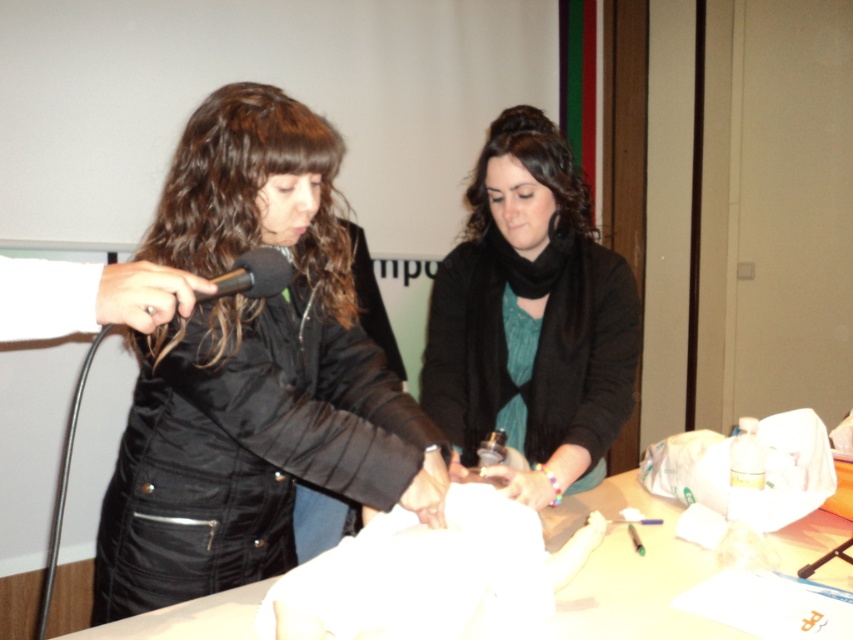
Question: Considering the real-world distances, which object is farthest from the white fabric at center?

Choices:
 (A) black matte jacket at center
 (B) black matte microphone at upper left

Answer: (B)

Question: Which point is farther to the camera?

Choices:
 (A) (451, 368)
 (B) (602, 556)
 (C) (461, 595)
 (D) (228, 275)

Answer: (A)

Question: Among these points, which one is nearest to the camera?

Choices:
 (A) (267, 156)
 (B) (200, 300)
 (C) (532, 148)
 (D) (374, 545)

Answer: (B)

Question: Is white fabric at center closer to camera compared to white paper at center?

Choices:
 (A) yes
 (B) no

Answer: (A)

Question: Does matte black scarf at center have a greater width compared to black matte microphone at upper left?

Choices:
 (A) no
 (B) yes

Answer: (B)

Question: Is matte black scarf at center further to the viewer compared to black matte microphone at upper left?

Choices:
 (A) yes
 (B) no

Answer: (A)